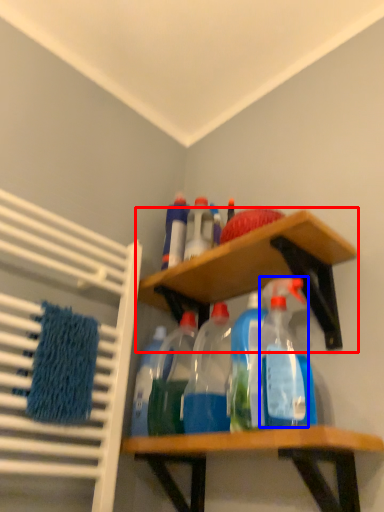
Question: Which point is closer to the camera, shelf (highlighted by a red box) or cleaning product (highlighted by a blue box)?

Choices:
 (A) shelf
 (B) cleaning product

Answer: (B)